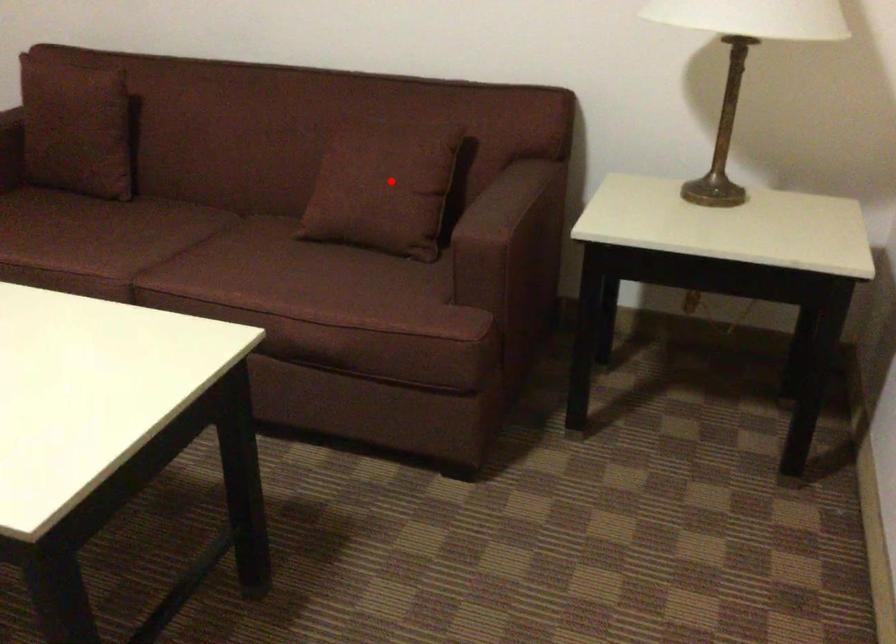
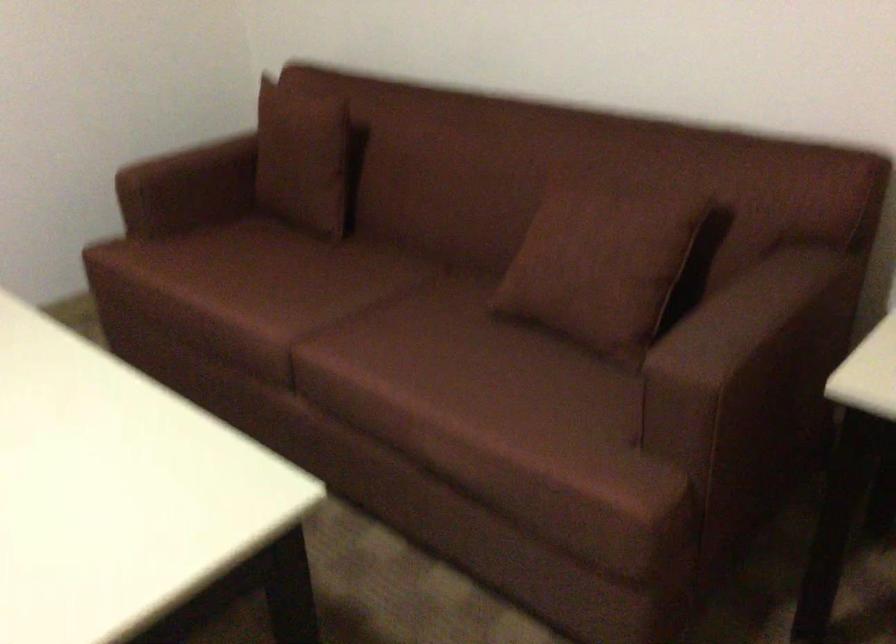
Question: I am providing you with two images of the same scene from different viewpoints. In image1, a red point is highlighted. Considering the same 3D point in image2, which of the following is correct?

Choices:
 (A) It is closer
 (B) It is farther

Answer: (A)